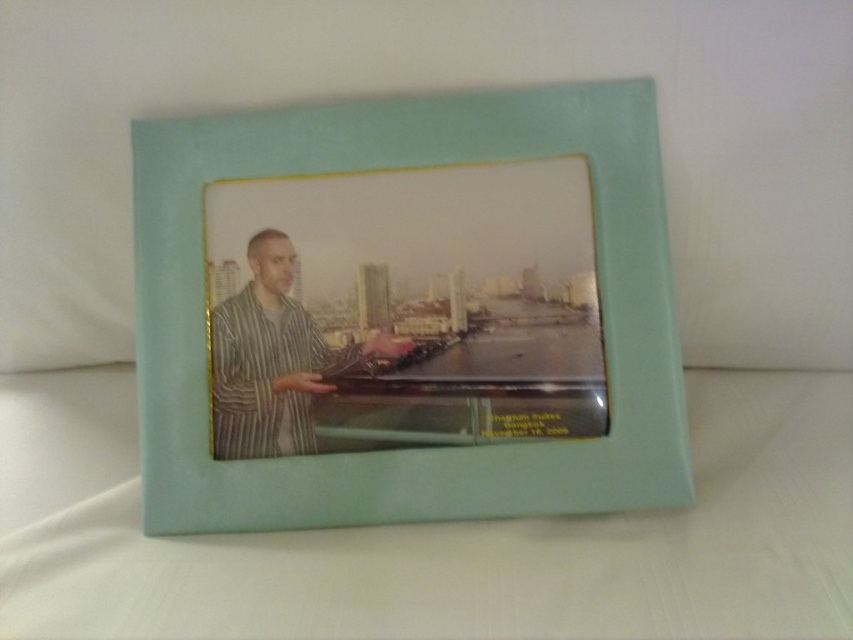
Measure the distance from mint green leather picture frame at center to striped fabric man at center.

mint green leather picture frame at center is 12.09 centimeters from striped fabric man at center.

Identify the location of mint green leather picture frame at center. The height and width of the screenshot is (640, 853). (410, 449).

Locate an element on the screen. The width and height of the screenshot is (853, 640). mint green leather picture frame at center is located at coordinates coord(410,449).

At what (x,y) coordinates should I click in order to perform the action: click on mint green leather picture frame at center. Please return your answer as a coordinate pair (x, y). This screenshot has width=853, height=640. Looking at the image, I should click on (410, 449).